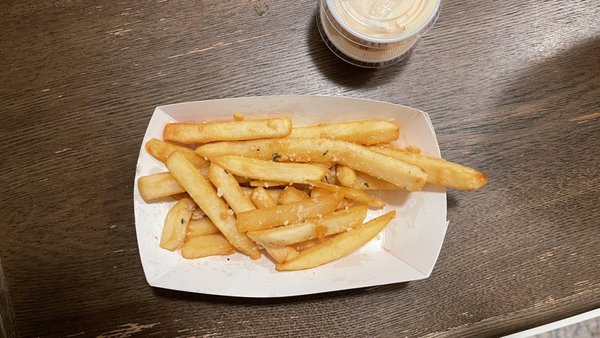
Find the location of a particular element. The width and height of the screenshot is (600, 338). wood table is located at coordinates (x=524, y=270).